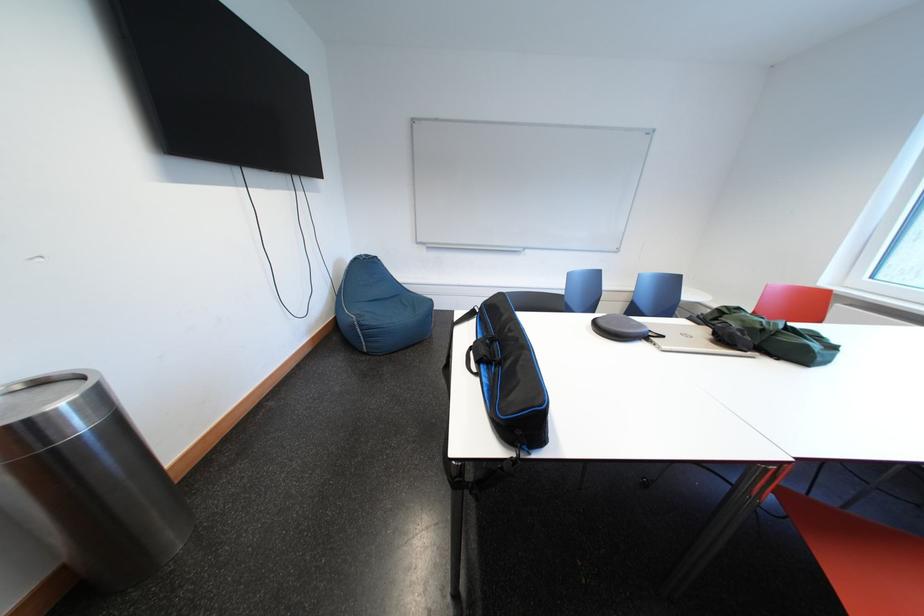
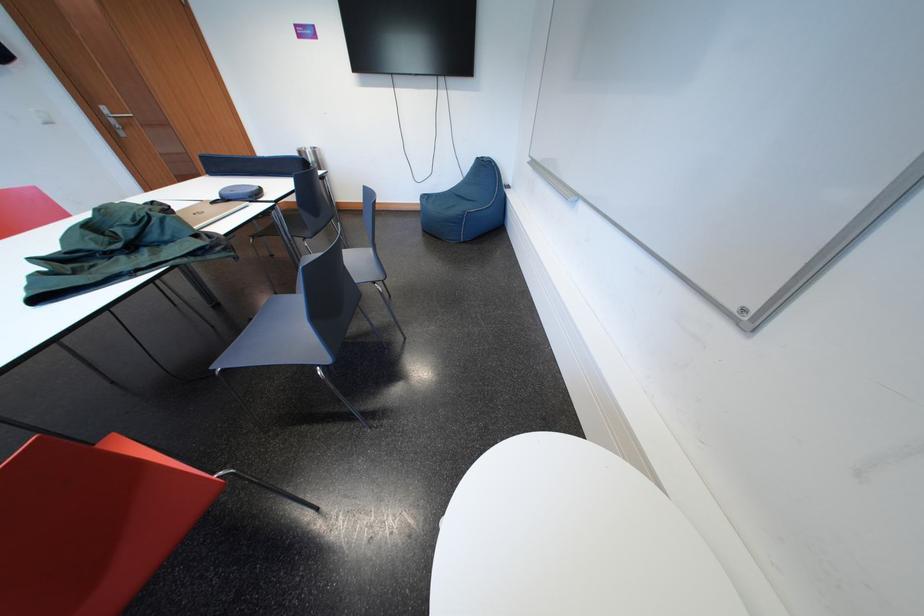
Find the pixel in the second image that matches [30,439] in the first image.

(309, 158)